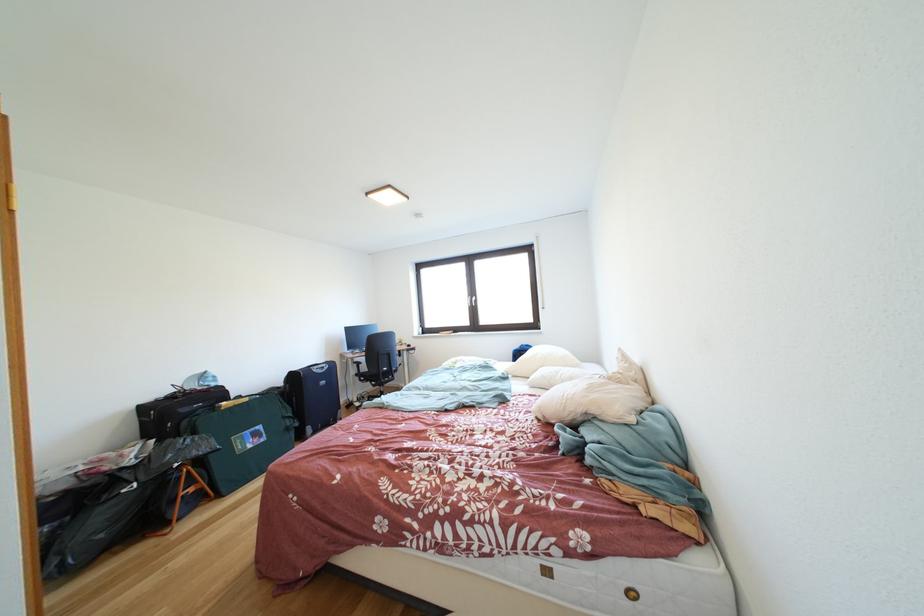
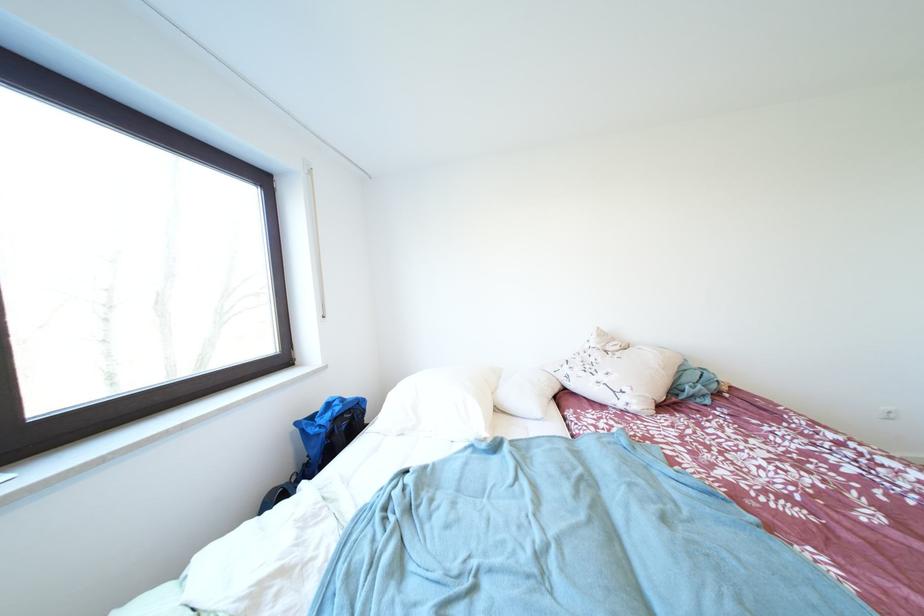
The point at (627, 354) is marked in the first image. Where is the corresponding point in the second image?

(606, 333)